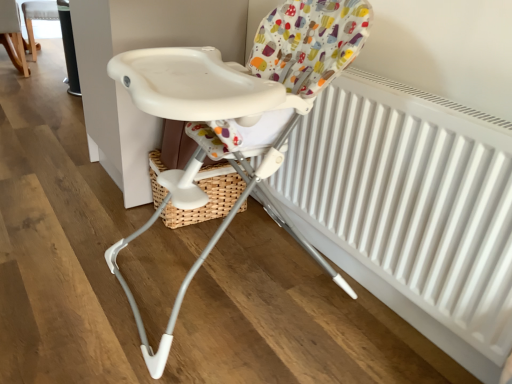
Question: Considering the relative sizes of white matte radiator at center and white plastic highchair at center, which ranks as the 1th chair in front-to-back order, in the image provided, is white matte radiator at center thinner than white plastic highchair at center, which ranks as the 1th chair in front-to-back order,?

Choices:
 (A) yes
 (B) no

Answer: (A)

Question: Does white matte radiator at center touch white plastic highchair at center, marked as the third chair in a top-to-bottom arrangement?

Choices:
 (A) no
 (B) yes

Answer: (A)

Question: Can you confirm if white matte radiator at center is smaller than white plastic highchair at center, marked as the third chair in a top-to-bottom arrangement?

Choices:
 (A) no
 (B) yes

Answer: (B)

Question: Does white matte radiator at center appear on the left side of white plastic highchair at center, marked as the third chair in a top-to-bottom arrangement?

Choices:
 (A) yes
 (B) no

Answer: (B)

Question: Is white matte radiator at center outside of white plastic highchair at center, which ranks as the 1th chair in front-to-back order?

Choices:
 (A) no
 (B) yes

Answer: (B)

Question: From a real-world perspective, is white matte radiator at center on top of white plastic highchair at center, the first chair positioned from the right?

Choices:
 (A) no
 (B) yes

Answer: (A)

Question: Is white plastic chair at upper left, the third chair viewed from the right, to the right of white plastic highchair at center, the first chair positioned from the right, from the viewer's perspective?

Choices:
 (A) yes
 (B) no

Answer: (B)

Question: Can you confirm if white plastic chair at upper left, the first chair viewed from the left, is bigger than white plastic highchair at center, acting as the first chair starting from the bottom?

Choices:
 (A) no
 (B) yes

Answer: (A)

Question: From a real-world perspective, is white plastic chair at upper left, the first chair viewed from the left, positioned over white plastic highchair at center, which ranks as the 1th chair in front-to-back order, based on gravity?

Choices:
 (A) no
 (B) yes

Answer: (A)

Question: Would you consider white plastic chair at upper left, the first chair viewed from the left, to be distant from white plastic highchair at center, arranged as the third chair when viewed from the back?

Choices:
 (A) no
 (B) yes

Answer: (B)

Question: Does white plastic chair at upper left, positioned as the 2th chair in back-to-front order, have a lesser height compared to white plastic highchair at center, marked as the third chair in a top-to-bottom arrangement?

Choices:
 (A) no
 (B) yes

Answer: (B)

Question: Can we say white plastic chair at upper left, the third chair viewed from the right, lies outside white plastic highchair at center, the first chair positioned from the right?

Choices:
 (A) no
 (B) yes

Answer: (B)

Question: Is white plastic highchair at upper center, the first chair from the back, inside white plastic chair at upper left, the first chair viewed from the left?

Choices:
 (A) yes
 (B) no

Answer: (B)